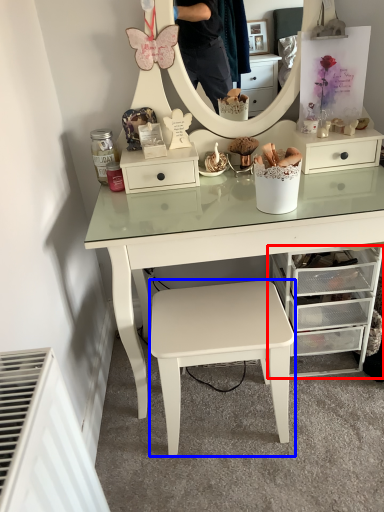
Question: Among these objects, which one is nearest to the camera, chest of drawers (highlighted by a red box) or stool (highlighted by a blue box)?

Choices:
 (A) chest of drawers
 (B) stool

Answer: (B)